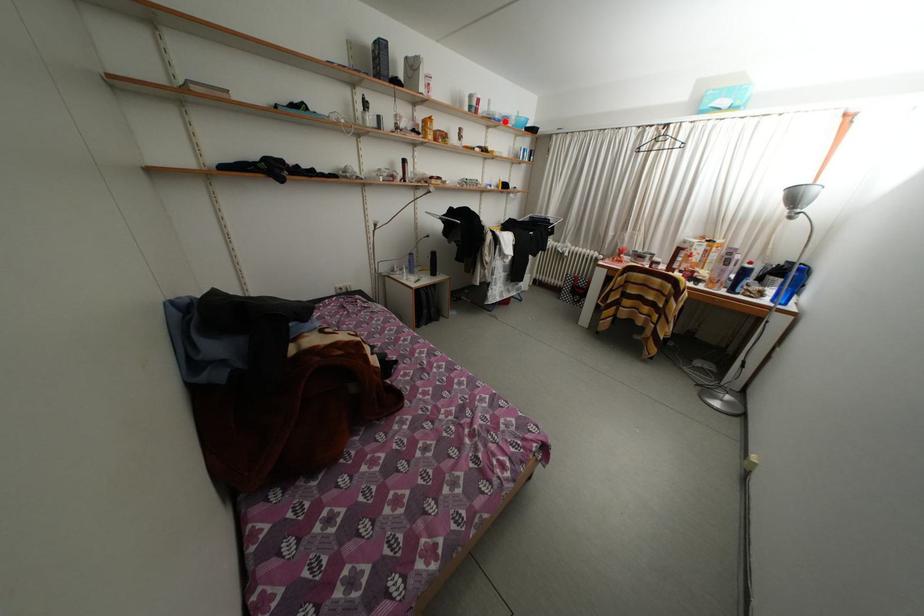
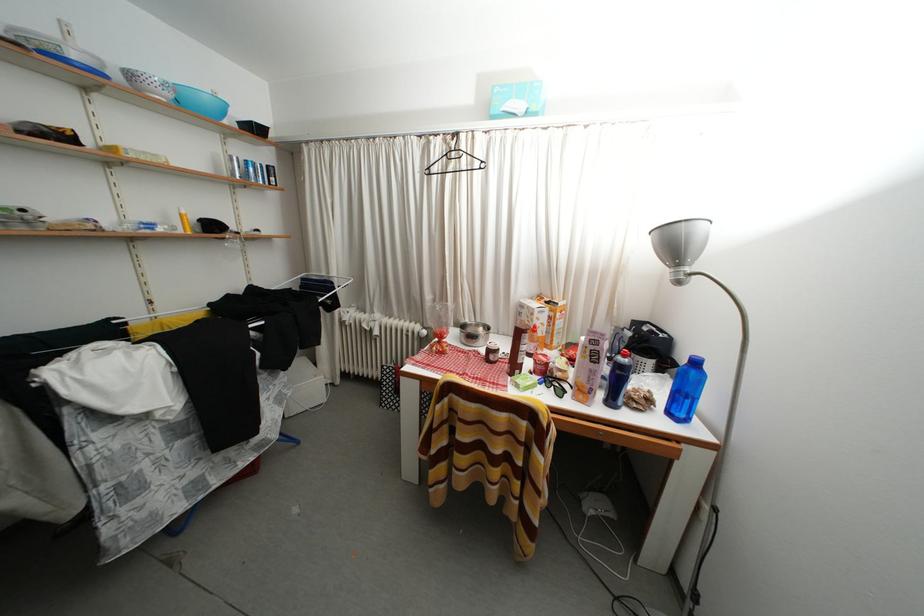
Question: I am providing you with two images of the same scene from different viewpoints. A red point is shown in image1. For the corresponding object point in image2, is it positioned nearer or farther from the camera?

Choices:
 (A) Nearer
 (B) Farther

Answer: (B)